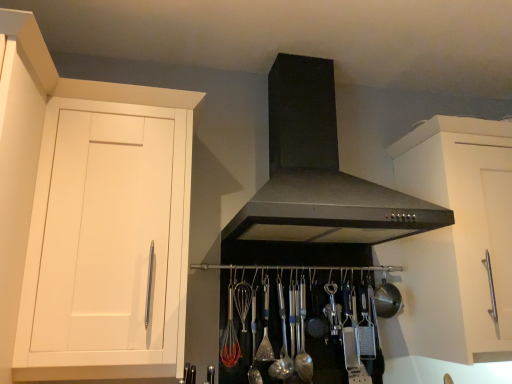
Question: Considering the positions of white matte cabinet at left, which is the 2th cabinetry from right to left, and satin silver spoon at center, which appears as the second utensil when viewed from the right, in the image, is white matte cabinet at left, which is the 2th cabinetry from right to left, taller or shorter than satin silver spoon at center, which appears as the second utensil when viewed from the right,?

Choices:
 (A) tall
 (B) short

Answer: (A)

Question: Is white matte cabinet at left, which is the 2th cabinetry from right to left, situated inside satin silver spoon at center, which appears as the second utensil when viewed from the right, or outside?

Choices:
 (A) outside
 (B) inside

Answer: (A)

Question: Which is farther from the white matte cabinet at right, arranged as the second cabinetry when viewed from the left?

Choices:
 (A) satin silver spoon at center, the 1th utensil when ordered from right to left
 (B) satin silver spoon at center, which appears as the second utensil when viewed from the right
 (C) metallic silver bowl at center
 (D) polished silver spoon at center, which ranks as the 3th utensil in right-to-left order
 (E) white matte cabinet at left, which is the 2th cabinetry from right to left

Answer: (E)

Question: Estimate the real-world distances between objects in this image. Which object is closer to the white matte cabinet at right, arranged as the second cabinetry when viewed from the left?

Choices:
 (A) black matte fume hood at center
 (B) satin silver spoon at center, the 4th utensil from the left
 (C) metallic silver bowl at center
 (D) polished silver spoon at center, marked as the second utensil in a left-to-right arrangement
 (E) satin silver spoon at center, marked as the 4th utensil in a right-to-left arrangement

Answer: (C)